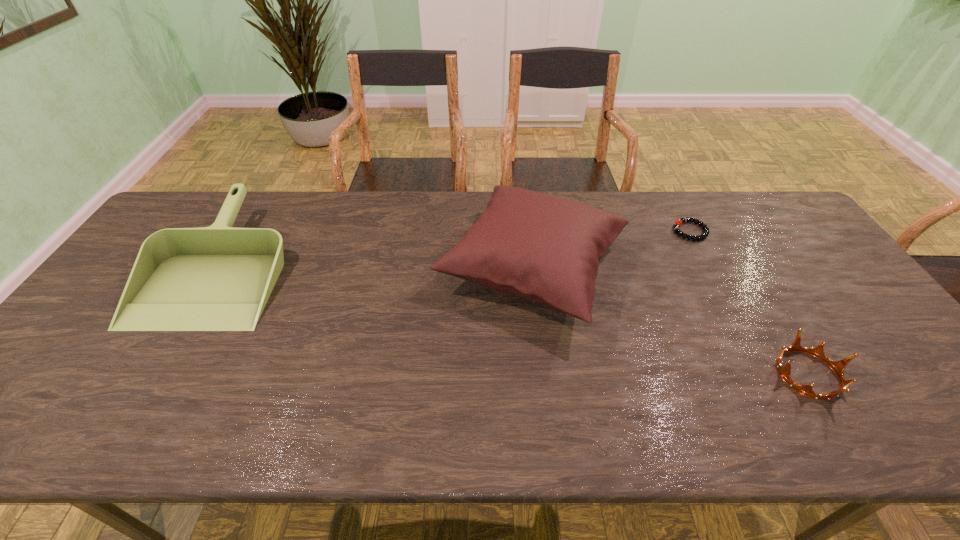
This screenshot has height=540, width=960. Find the location of `cushion that is at the far edge`. cushion that is at the far edge is located at coordinates (546, 249).

Image resolution: width=960 pixels, height=540 pixels. I want to click on dustpan located at the far edge, so click(218, 278).

Identify the location of bracelet that is at the far edge. This screenshot has width=960, height=540. (679, 222).

What are the coordinates of `object positioned at the near edge` in the screenshot? It's located at (838, 367).

Find the location of a particular element. object situated at the left edge is located at coordinates (218, 278).

Locate an element on the screen. object that is at the far left corner is located at coordinates [218, 278].

The width and height of the screenshot is (960, 540). In order to click on free space at the far edge of the desktop in this screenshot , I will do `click(707, 199)`.

Find the location of a particular element. vacant space at the near edge of the desktop is located at coordinates (850, 431).

What are the coordinates of `vacant space at the right edge of the desktop` in the screenshot? It's located at (851, 364).

At what (x,y) coordinates should I click in order to perform the action: click on free space at the near left corner of the desktop. Please return your answer as a coordinate pair (x, y). The width and height of the screenshot is (960, 540). Looking at the image, I should click on (50, 414).